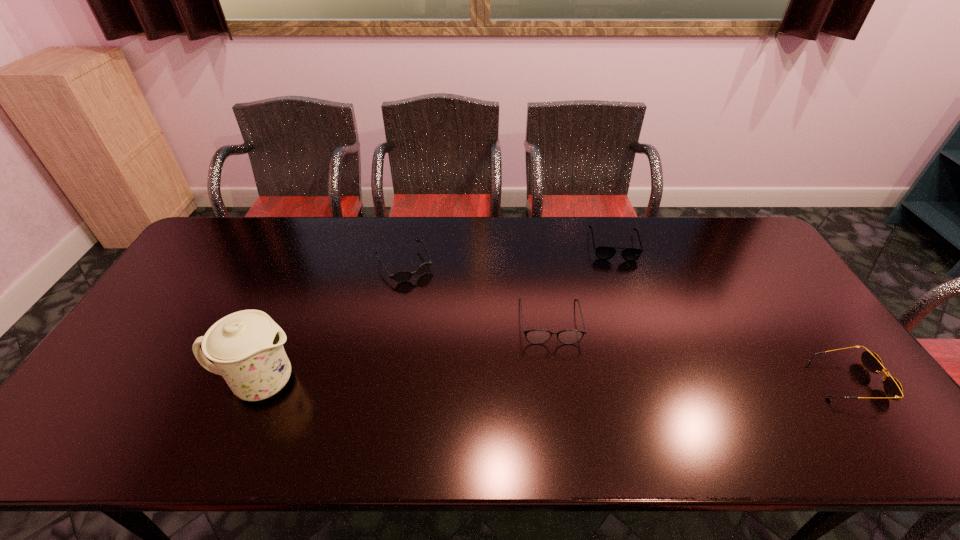
The width and height of the screenshot is (960, 540). What are the coordinates of `free space located on the spout of the chinaware` in the screenshot? It's located at (372, 382).

The width and height of the screenshot is (960, 540). I want to click on vacant space situated 0.360m on the front-facing side of the second object from right to left, so tap(634, 349).

This screenshot has width=960, height=540. I want to click on vacant area situated 0.330m on the front-facing side of the second object from right to left, so (x=633, y=340).

Locate an element on the screen. This screenshot has height=540, width=960. free region located 0.190m on the front-facing side of the second object from right to left is located at coordinates (625, 303).

You are a GUI agent. You are given a task and a screenshot of the screen. Output one action in this format:
    pyautogui.click(x=<x>, y=<y>)
    Task: Click on the vacant space located 0.390m on the lenses of the farther sunglasses
    This screenshot has height=540, width=960.
    Given the screenshot: What is the action you would take?
    [475, 374]

At what (x,y) coordinates should I click in order to perform the action: click on blank area located 0.230m on the lenses of the farther sunglasses. Please return your answer as a coordinate pair (x, y). This screenshot has width=960, height=540. Looking at the image, I should click on (447, 332).

Where is `blank space located 0.280m on the lenses of the farther sunglasses`? The width and height of the screenshot is (960, 540). blank space located 0.280m on the lenses of the farther sunglasses is located at coordinates (456, 344).

The image size is (960, 540). Identify the location of vacant space located 0.080m on the front-facing side of the left spectacles. (556, 370).

Identify the location of vacant point located on the front-facing side of the left spectacles. The height and width of the screenshot is (540, 960). (560, 397).

Image resolution: width=960 pixels, height=540 pixels. What are the coordinates of `vacant space located on the front-facing side of the left spectacles` in the screenshot? It's located at (557, 376).